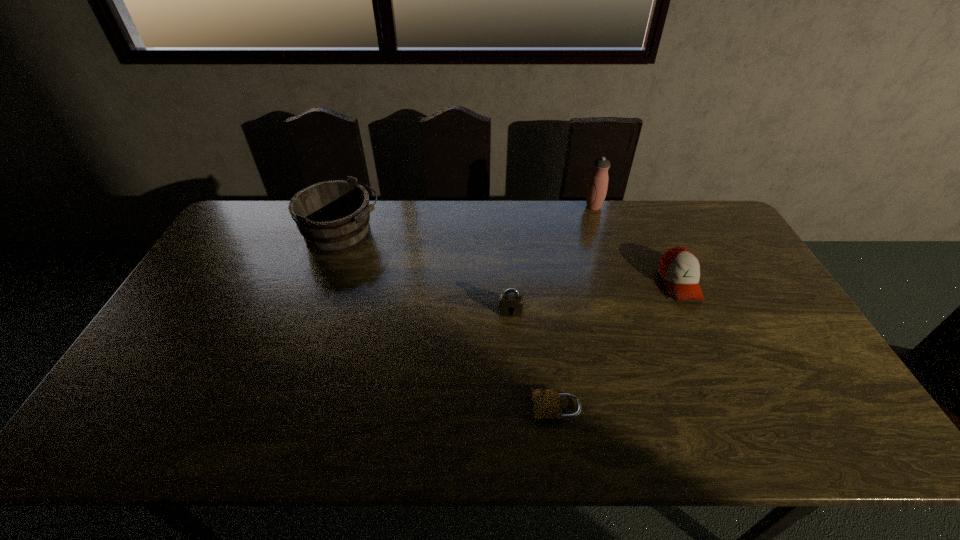
This screenshot has width=960, height=540. In order to click on free space at the near edge of the desktop in this screenshot , I will do `click(195, 443)`.

I want to click on blank area at the left edge, so click(x=178, y=381).

Where is `free space at the right edge of the desktop`? free space at the right edge of the desktop is located at coordinates (791, 342).

Identify the location of vacant space at the far left corner of the desktop. (244, 239).

Locate an element on the screen. free space between the farthest object and the second object from left to right is located at coordinates (552, 259).

The width and height of the screenshot is (960, 540). I want to click on vacant area that lies between the wine bucket and the baseball cap, so click(511, 260).

At what (x,y) coordinates should I click in order to perform the action: click on free space between the thermos bottle and the left padlock. Please return your answer as a coordinate pair (x, y). Looking at the image, I should click on (552, 259).

Locate an element on the screen. vacant area that lies between the shortest object and the tallest object is located at coordinates (575, 307).

Locate an element on the screen. This screenshot has width=960, height=540. blank region between the fourth shortest object and the farther padlock is located at coordinates (426, 274).

The height and width of the screenshot is (540, 960). I want to click on free spot between the left padlock and the baseball cap, so click(595, 298).